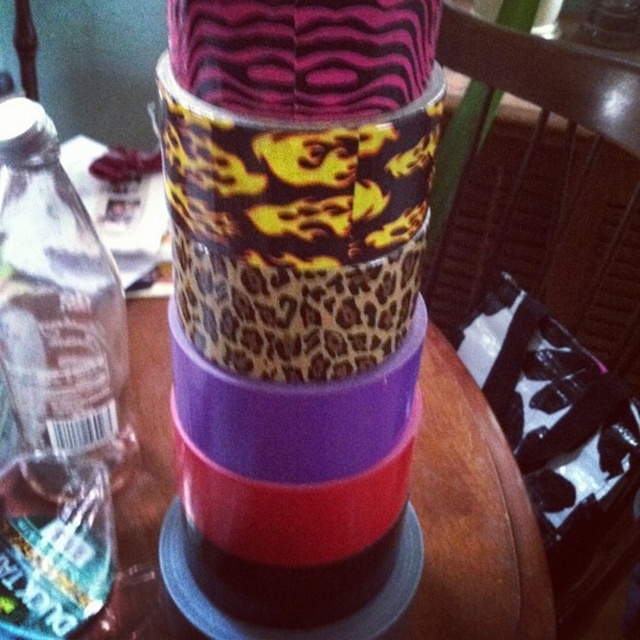
Who is more forward, (307,540) or (147,310)?

Point (307,540)

Can you confirm if leopard print tape at center is wider than purple matte plastic table at center?

No.

This screenshot has width=640, height=640. In order to click on leopard print tape at center in this screenshot , I will do `click(296, 308)`.

Find the location of a particular element. leopard print tape at center is located at coordinates (296, 308).

Who is shorter, purple matte plastic table at center or clear plastic bottle at left?

With less height is clear plastic bottle at left.

Does purple matte plastic table at center have a greater width compared to clear plastic bottle at left?

Correct, the width of purple matte plastic table at center exceeds that of clear plastic bottle at left.

The width and height of the screenshot is (640, 640). In order to click on purple matte plastic table at center in this screenshot , I will do `click(472, 518)`.

Does leopard print tape at center appear over clear plastic bottle at left?

Actually, leopard print tape at center is below clear plastic bottle at left.

What do you see at coordinates (296, 308) in the screenshot? This screenshot has width=640, height=640. I see `leopard print tape at center` at bounding box center [296, 308].

Identify the location of leopard print tape at center. (296, 308).

I want to click on leopard print tape at center, so click(x=296, y=308).